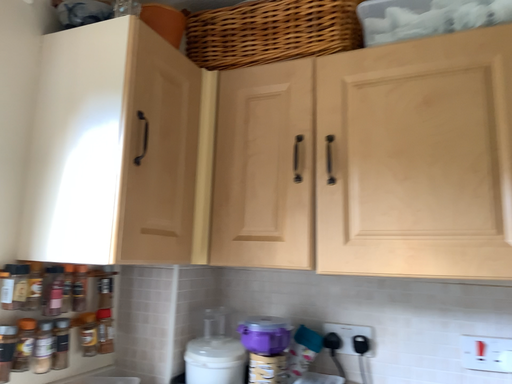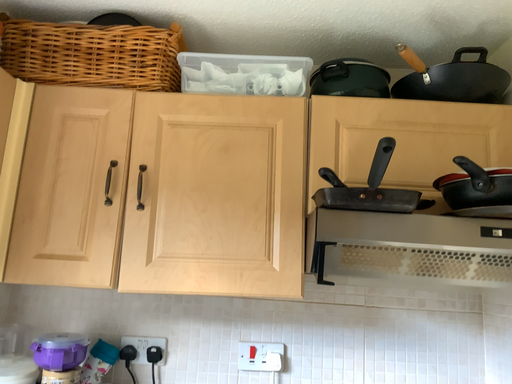
Question: Which way did the camera rotate in the video?

Choices:
 (A) rotated left
 (B) rotated right

Answer: (B)